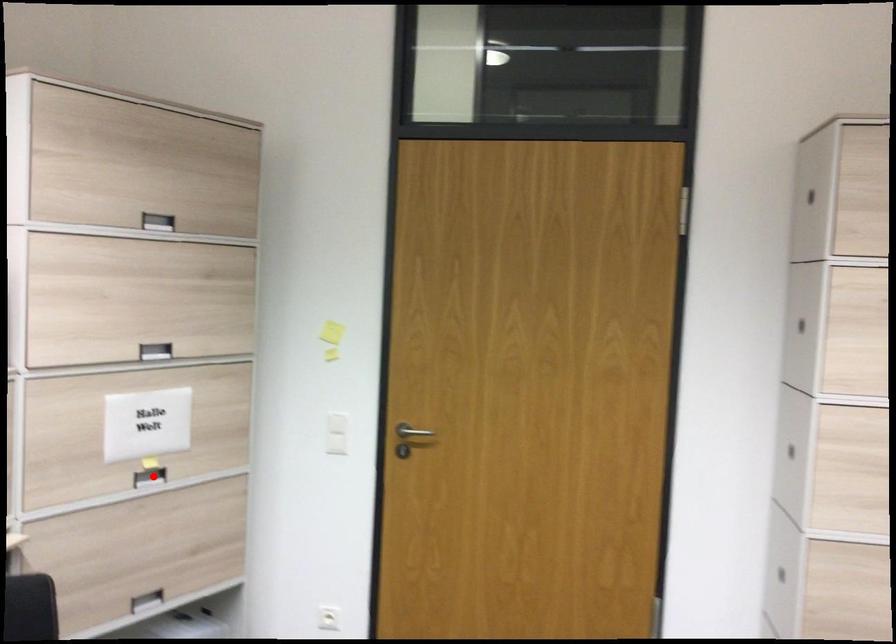
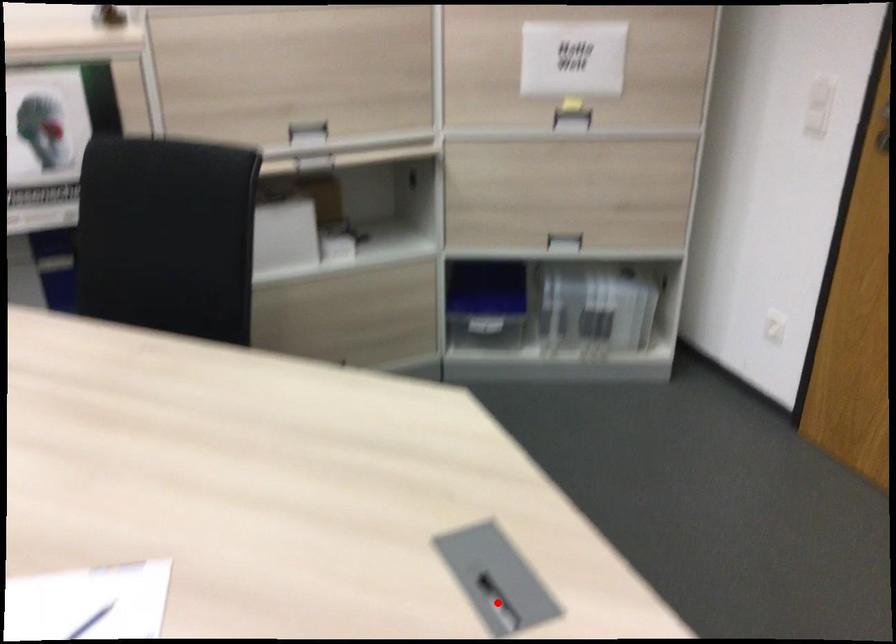
I am providing you with two images of the same scene from different viewpoints. A red point is marked on the first image and another point is marked on the second image. Is the marked point in image1 the same physical position as the marked point in image2?

No